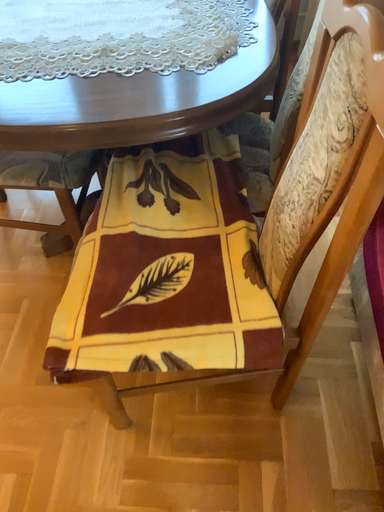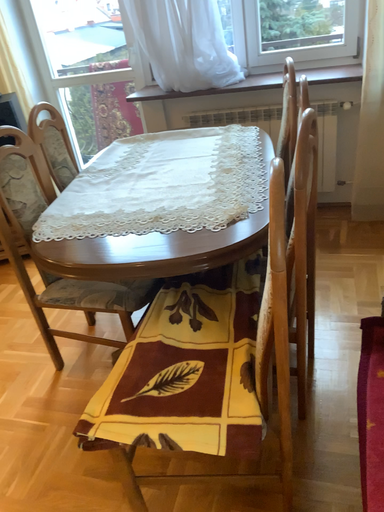
Question: Which way did the camera rotate in the video?

Choices:
 (A) rotated left
 (B) rotated right

Answer: (A)